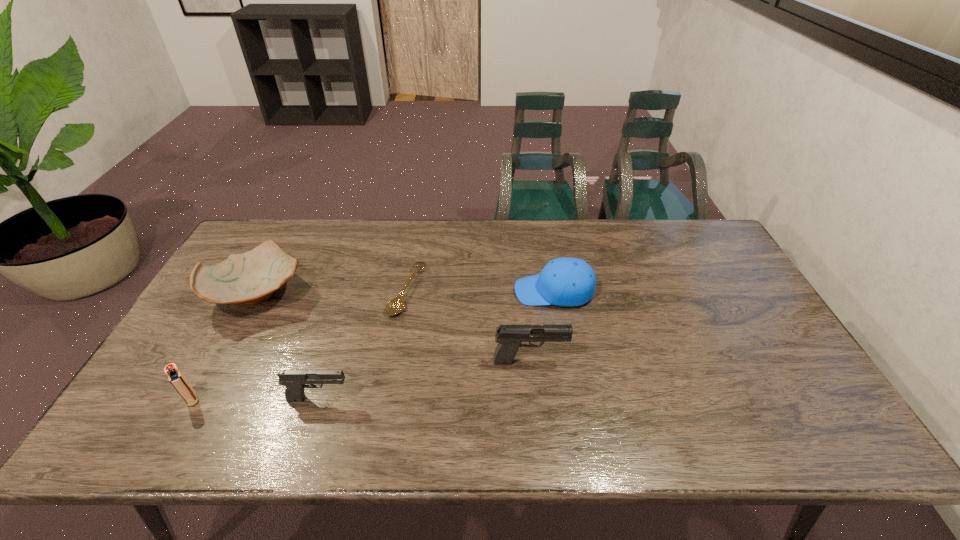
Locate an element on the screen. The image size is (960, 540). vacant area between the igniter and the farther pistol is located at coordinates (361, 380).

Image resolution: width=960 pixels, height=540 pixels. Find the location of `vacant space that is in between the nearer pistol and the pottery`. vacant space that is in between the nearer pistol and the pottery is located at coordinates (289, 346).

Identify the location of vacant area that lies between the shorter pistol and the pottery. This screenshot has height=540, width=960. (289, 346).

This screenshot has height=540, width=960. In order to click on vacant area that lies between the nearer pistol and the cap in this screenshot , I will do `click(437, 345)`.

Locate an element on the screen. Image resolution: width=960 pixels, height=540 pixels. free space that is in between the pottery and the shorter pistol is located at coordinates (289, 346).

Locate an element on the screen. blank region between the pottery and the left pistol is located at coordinates (289, 346).

This screenshot has height=540, width=960. Find the location of `vacant space in between the igniter and the pottery`. vacant space in between the igniter and the pottery is located at coordinates (226, 346).

Locate an element on the screen. unoccupied area between the pottery and the cap is located at coordinates (406, 292).

Select which object appears as the closest to the igniter. Please provide its 2D coordinates. Your answer should be formatted as a tuple, i.e. [(x, y)], where the tuple contains the x and y coordinates of a point satisfying the conditions above.

[(252, 277)]

Where is `object that stands as the fifth closest to the cap`? The width and height of the screenshot is (960, 540). object that stands as the fifth closest to the cap is located at coordinates (176, 378).